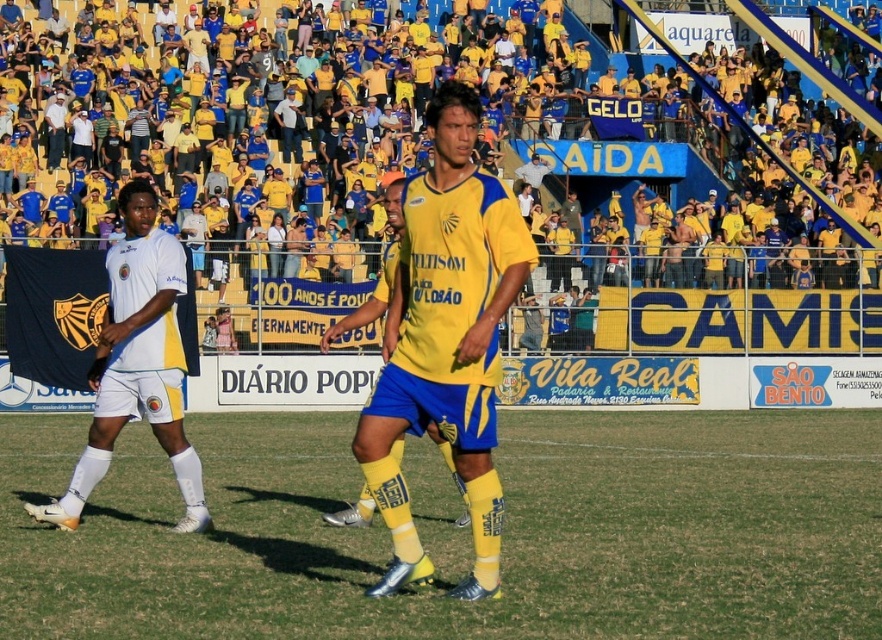
You are a soccer fan sitting in the stands and want to take a photo of both the point at coordinates (x=377, y=152) and the point at coordinates (x=176, y=324). Which point will appear closer to the camera in your photo?

Point (x=377, y=152) is further to the viewer than point (x=176, y=324), so in the photo, the point at (x=176, y=324) will appear closer to the camera.

You are a photographer at the soccer match. You want to capture a photo that includes both the yellow jersey at upper center and the white matte shorts at left. Based on their positions, which object should you focus on first to ensure both are in frame?

The yellow jersey at upper center is above the white matte shorts at left, so you should focus on the yellow jersey at upper center first to ensure both are in frame.

You are a photographer trying to capture a clear shot of the yellow matte jersey at center and the white matte shorts at left. Since you want both subjects to be in focus, which one should you focus on first?

The yellow matte jersey at center is in front of the white matte shorts at left, so you should focus on the yellow matte jersey at center first to ensure both are in focus.